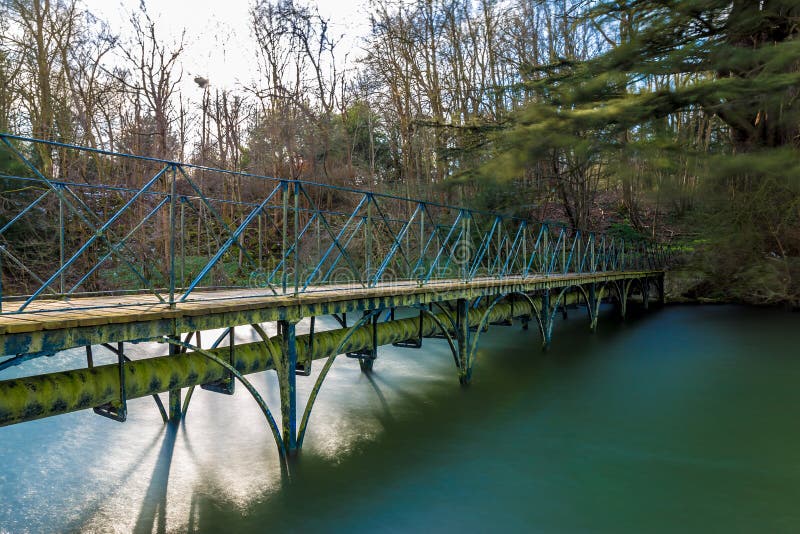
Where is `wooden boards`? The height and width of the screenshot is (534, 800). wooden boards is located at coordinates click(57, 320).